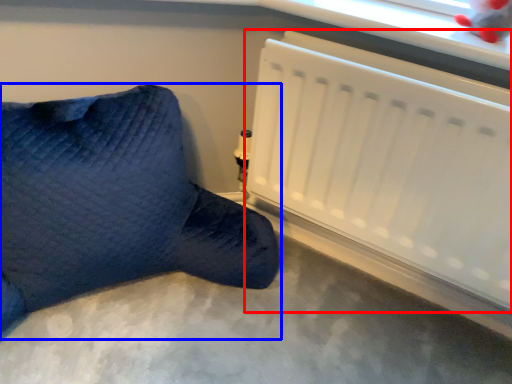
Question: Which object is further to the camera taking this photo, radiator (highlighted by a red box) or furniture (highlighted by a blue box)?

Choices:
 (A) radiator
 (B) furniture

Answer: (A)